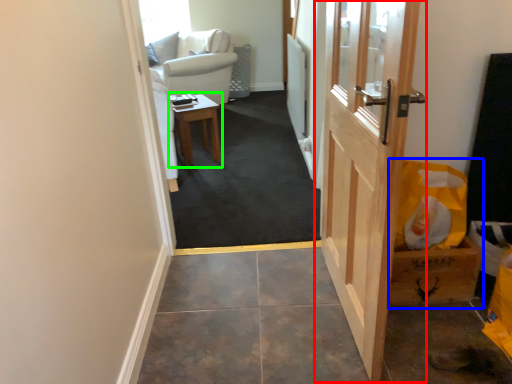
Question: Which is nearer to the door (highlighted by a red box)? cardboard box (highlighted by a blue box) or table (highlighted by a green box).

Choices:
 (A) cardboard box
 (B) table

Answer: (A)